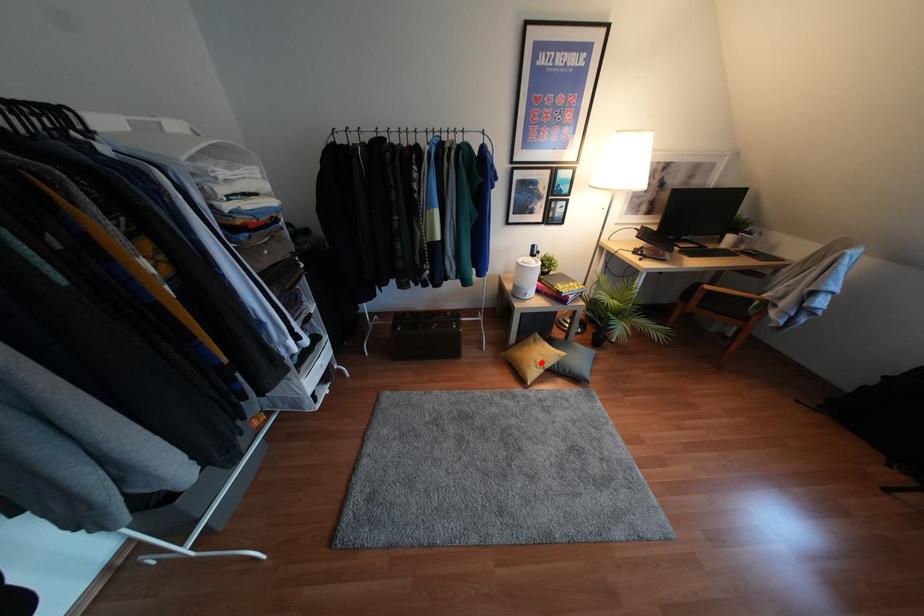
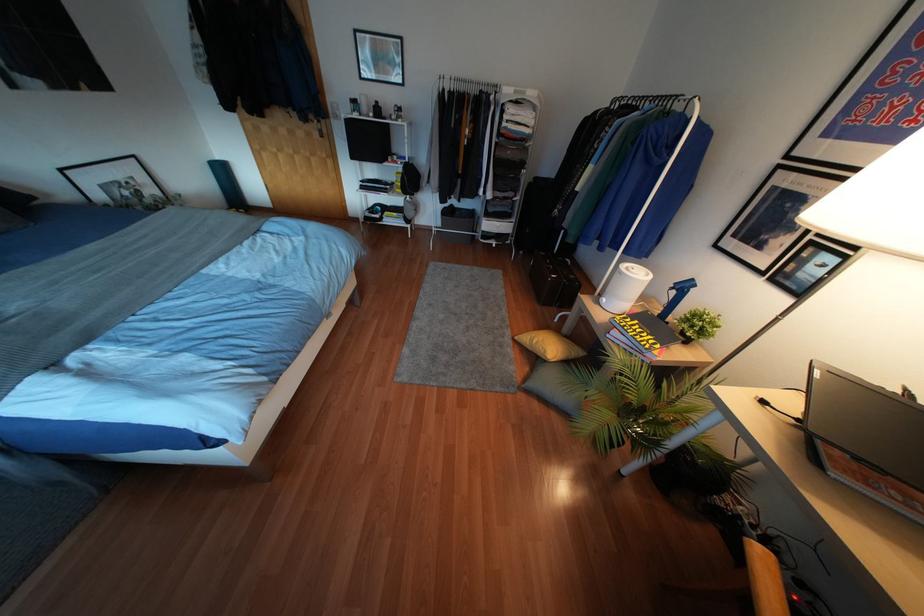
Question: I am providing you with two images of the same scene from different viewpoints. In image1, a red point is highlighted. Considering the same 3D point in image2, which of the following is correct?

Choices:
 (A) It is closer
 (B) It is farther

Answer: (A)